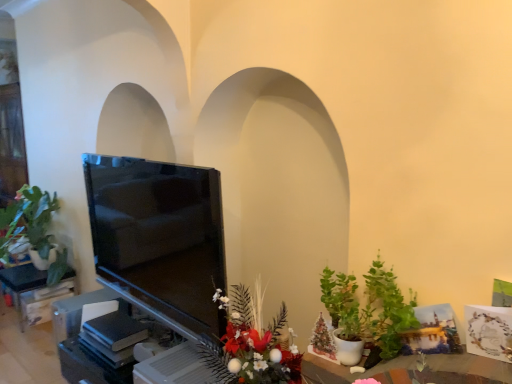
Question: Does matte black tv at left appear on the right side of green matte plant at left, the 2th houseplant positioned from the front?

Choices:
 (A) yes
 (B) no

Answer: (A)

Question: Does matte black tv at left have a smaller size compared to green matte plant at left, the first houseplant when ordered from back to front?

Choices:
 (A) yes
 (B) no

Answer: (A)

Question: Does matte black tv at left turn towards green matte plant at left, the 2th houseplant positioned from the front?

Choices:
 (A) no
 (B) yes

Answer: (A)

Question: Is matte black tv at left not inside green matte plant at left, the 2th houseplant from the right?

Choices:
 (A) no
 (B) yes

Answer: (B)

Question: From a real-world perspective, is matte black tv at left under green matte plant at left, arranged as the first houseplant when viewed from the left?

Choices:
 (A) no
 (B) yes

Answer: (B)

Question: Considering the relative positions of glossy floral arrangement at lower center and matte black tv at left in the image provided, is glossy floral arrangement at lower center to the left or to the right of matte black tv at left?

Choices:
 (A) left
 (B) right

Answer: (B)

Question: Considering their positions, is glossy floral arrangement at lower center located in front of or behind matte black tv at left?

Choices:
 (A) front
 (B) behind

Answer: (A)

Question: Choose the correct answer: Is glossy floral arrangement at lower center inside matte black tv at left or outside it?

Choices:
 (A) outside
 (B) inside

Answer: (A)

Question: In terms of width, does glossy floral arrangement at lower center look wider or thinner when compared to matte black tv at left?

Choices:
 (A) wide
 (B) thin

Answer: (B)

Question: Considering the positions of green matte plant at lower right, acting as the 1th houseplant starting from the front, and matte black tv at left in the image, is green matte plant at lower right, acting as the 1th houseplant starting from the front, taller or shorter than matte black tv at left?

Choices:
 (A) short
 (B) tall

Answer: (A)

Question: In the image, is green matte plant at lower right, the 1th houseplant viewed from the right, on the left side or the right side of matte black tv at left?

Choices:
 (A) left
 (B) right

Answer: (B)

Question: In terms of size, does green matte plant at lower right, acting as the 1th houseplant starting from the front, appear bigger or smaller than matte black tv at left?

Choices:
 (A) big
 (B) small

Answer: (B)

Question: From the image's perspective, is green matte plant at lower right, the 1th houseplant viewed from the right, positioned above or below matte black tv at left?

Choices:
 (A) below
 (B) above

Answer: (A)

Question: Is matte black tv at left in front of or behind green matte plant at lower right, the 2th houseplant positioned from the back, in the image?

Choices:
 (A) front
 (B) behind

Answer: (B)

Question: Is matte black tv at left wider or thinner than green matte plant at lower right, acting as the 1th houseplant starting from the front?

Choices:
 (A) thin
 (B) wide

Answer: (B)